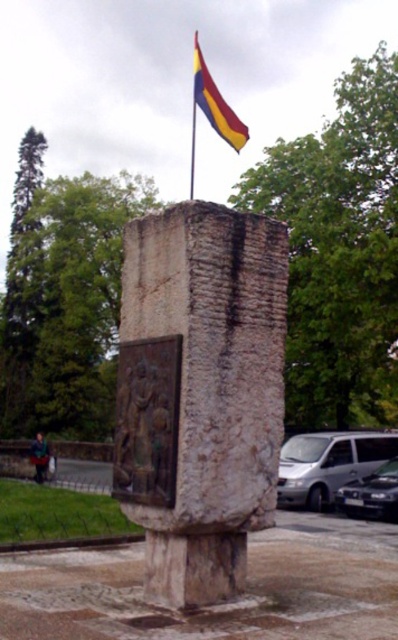
Question: Which point is farther to the camera?

Choices:
 (A) yellow and red striped flag at upper center
 (B) metallic flag pole at upper center
 (C) white stone monument at center

Answer: (B)

Question: Does yellow and red striped flag at upper center have a larger size compared to metallic flag pole at upper center?

Choices:
 (A) no
 (B) yes

Answer: (B)

Question: Which point is closer to the camera?

Choices:
 (A) metallic flag pole at upper center
 (B) white stone monument at center
 (C) yellow and red striped flag at upper center

Answer: (B)

Question: Among these objects, which one is farthest from the camera?

Choices:
 (A) white stone monument at center
 (B) metallic flag pole at upper center
 (C) yellow and red striped flag at upper center

Answer: (B)

Question: Is white stone monument at center to the right of yellow and red striped flag at upper center from the viewer's perspective?

Choices:
 (A) yes
 (B) no

Answer: (A)

Question: Does white stone monument at center have a smaller size compared to metallic flag pole at upper center?

Choices:
 (A) yes
 (B) no

Answer: (A)